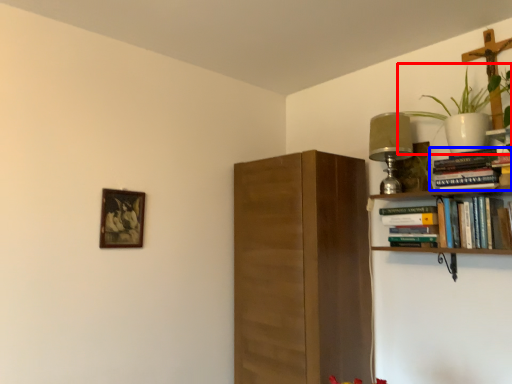
Question: Among these objects, which one is farthest to the camera, houseplant (highlighted by a red box) or book (highlighted by a blue box)?

Choices:
 (A) houseplant
 (B) book

Answer: (B)